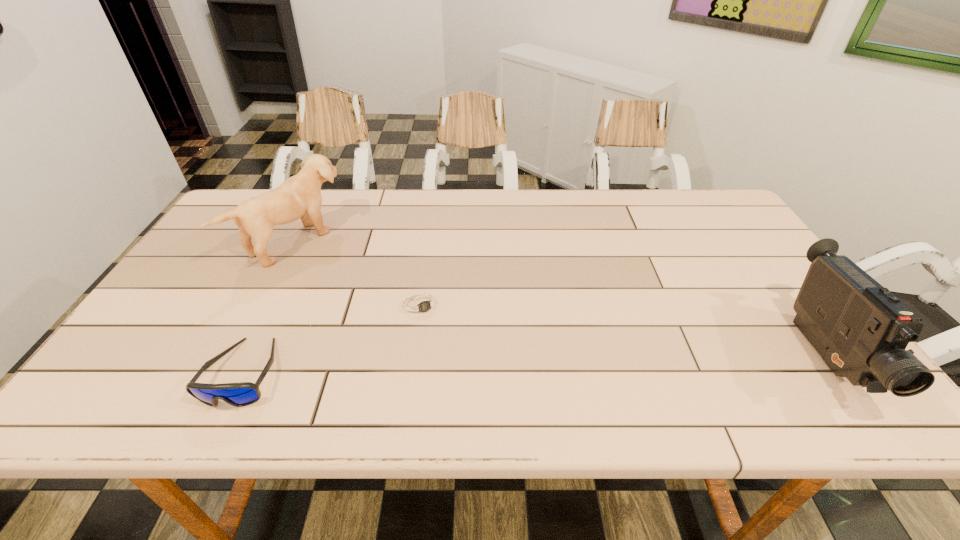
Where is `free space on the desktop that is between the second shortest object and the camcorder and is positioned on the face of the shortest object`? Image resolution: width=960 pixels, height=540 pixels. free space on the desktop that is between the second shortest object and the camcorder and is positioned on the face of the shortest object is located at coordinates (457, 367).

Where is `free spot on the desktop that is between the second shortest object and the camcorder and is positioned on the left side of the puppy`? free spot on the desktop that is between the second shortest object and the camcorder and is positioned on the left side of the puppy is located at coordinates (500, 366).